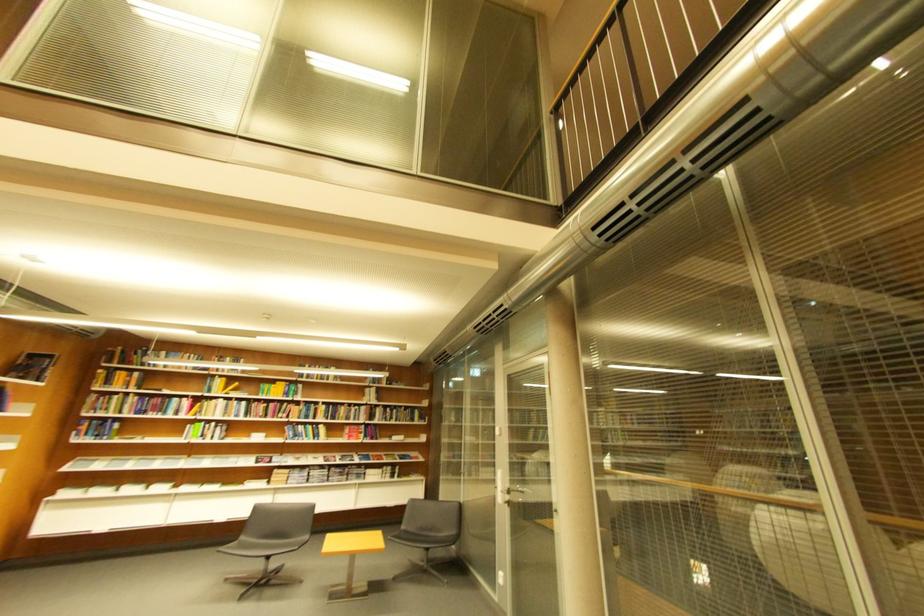
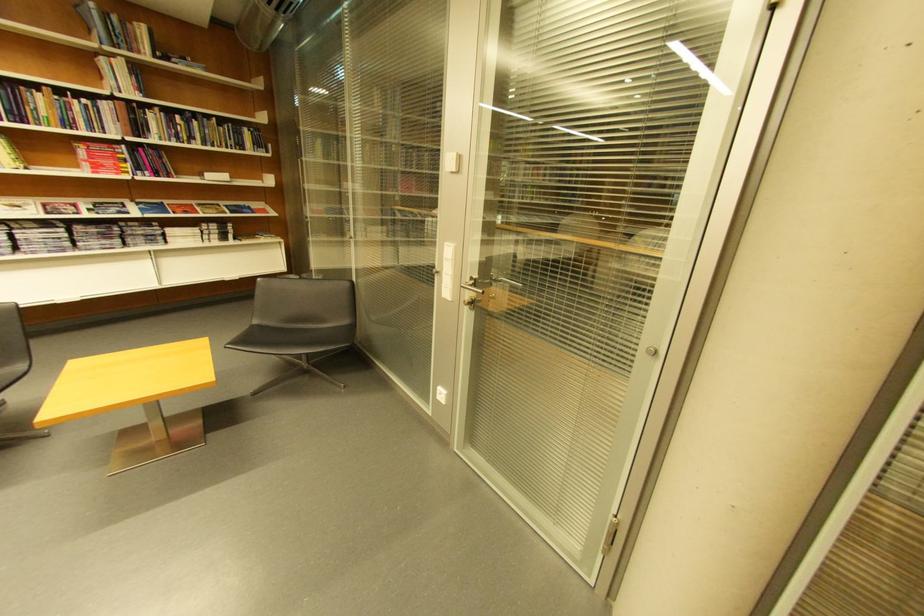
Locate, in the second image, the point that corresponds to (379,391) in the first image.

(113, 62)